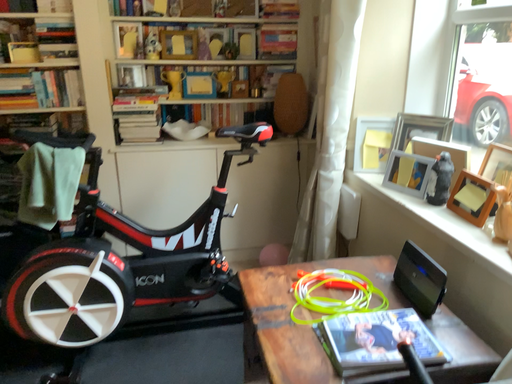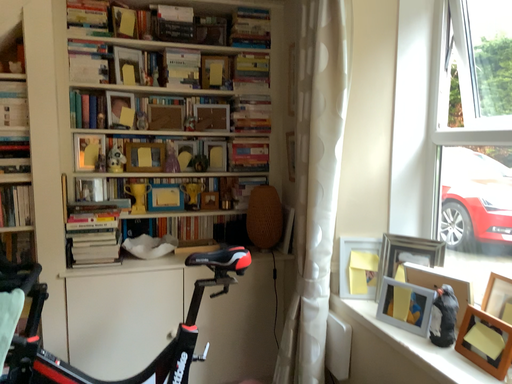
Question: How did the camera likely rotate when shooting the video?

Choices:
 (A) rotated downward
 (B) rotated upward

Answer: (B)